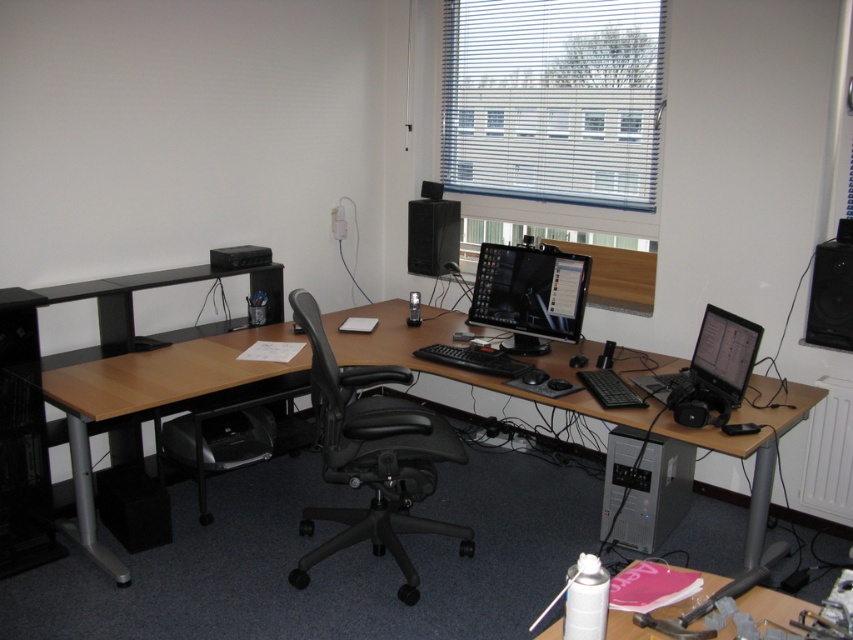
What object is located at the coordinates point (155, 401)?

The wooden desk at center is located at point (155, 401).

You are organizing your workspace and need to place a new document holder between the wooden desk at center and the black matte laptop at center. Based on their positions, which object should the document holder be placed closer to?

The document holder should be placed closer to the wooden desk at center because the black matte laptop at center is positioned to the right of the wooden desk at center.